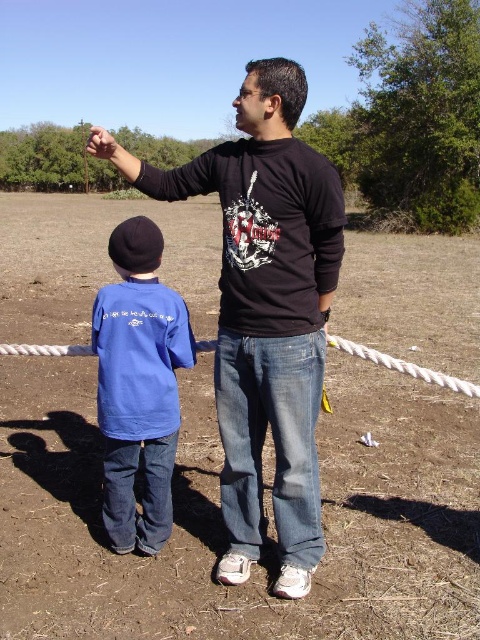
Question: Is black cotton shirt at center to the left of blue cotton shirt at lower left from the viewer's perspective?

Choices:
 (A) yes
 (B) no

Answer: (B)

Question: Which object appears farthest from the camera in this image?

Choices:
 (A) black cotton shirt at center
 (B) brown dirt field at center
 (C) blue cotton shirt at lower left

Answer: (C)

Question: Can you confirm if brown dirt field at center is smaller than blue cotton shirt at lower left?

Choices:
 (A) no
 (B) yes

Answer: (A)

Question: Based on their relative distances, which object is farther from the brown dirt field at center?

Choices:
 (A) blue cotton shirt at lower left
 (B) black cotton shirt at center

Answer: (A)

Question: Is brown dirt field at center wider than blue cotton shirt at lower left?

Choices:
 (A) no
 (B) yes

Answer: (B)

Question: Which point is farther to the camera?

Choices:
 (A) (244, 410)
 (B) (394, 339)

Answer: (B)